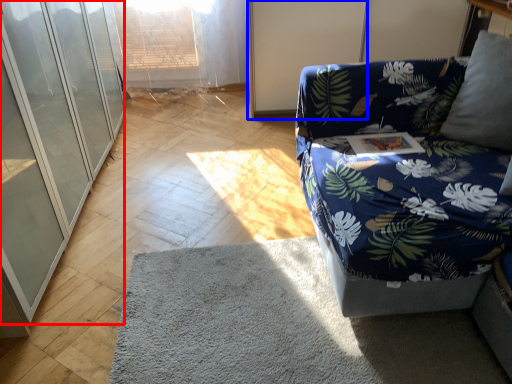
Question: Which of the following is the farthest to the observer, glass door (highlighted by a red box) or screen door (highlighted by a blue box)?

Choices:
 (A) glass door
 (B) screen door

Answer: (B)